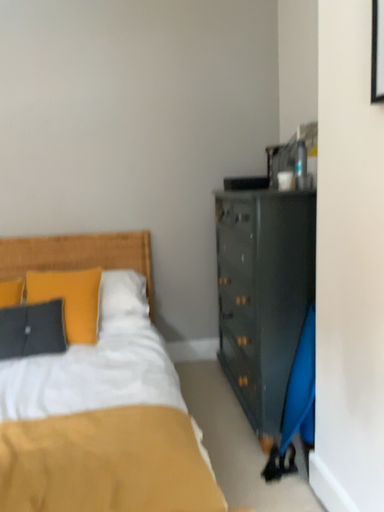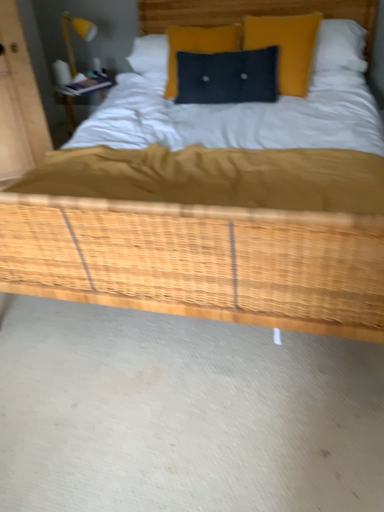
Question: Which way did the camera rotate in the video?

Choices:
 (A) rotated left
 (B) rotated right

Answer: (A)